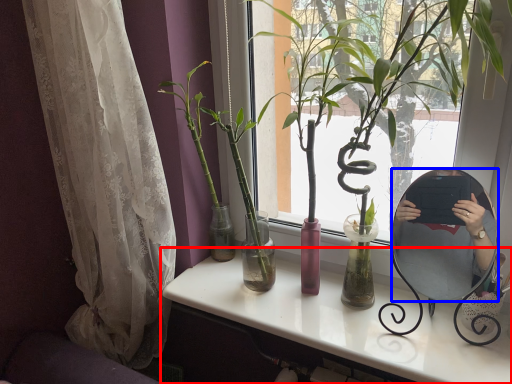
Question: Which of the following is the farthest to the observer, desk (highlighted by a red box) or mirror (highlighted by a blue box)?

Choices:
 (A) desk
 (B) mirror

Answer: (B)